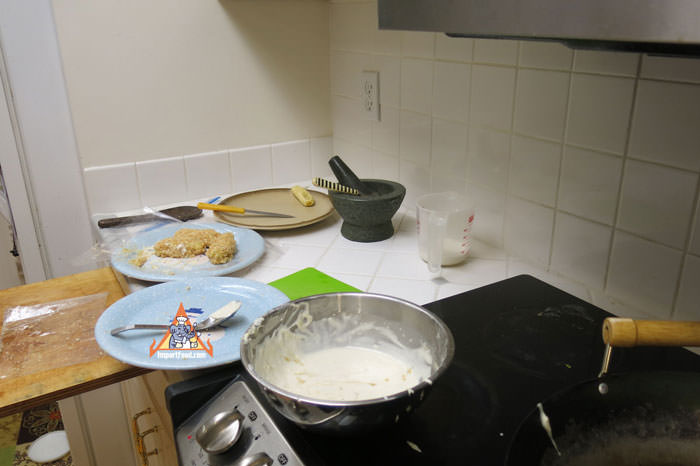
Locate an element on the screen. cup is located at coordinates (461, 233).